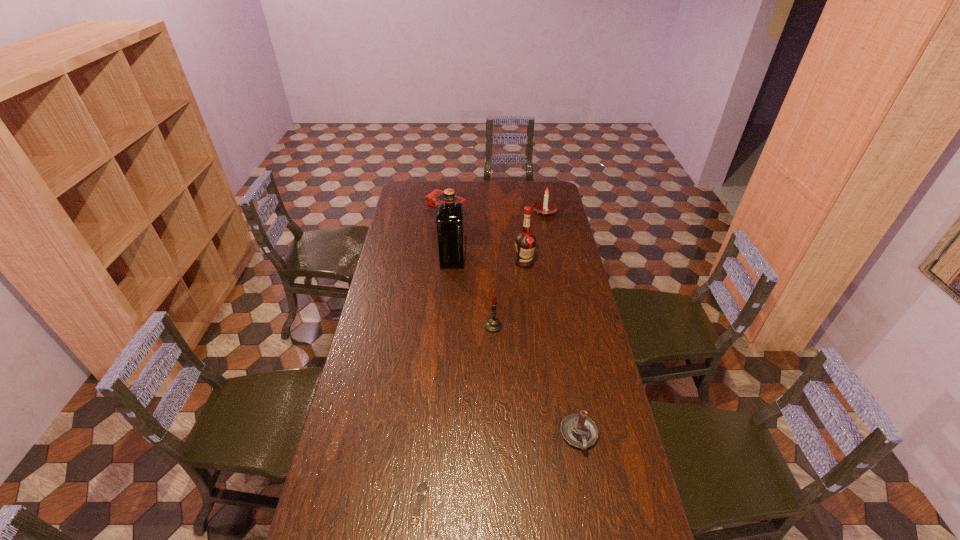
Where is `free space at the left edge`? Image resolution: width=960 pixels, height=540 pixels. free space at the left edge is located at coordinates (339, 525).

In the image, there is a desktop. Where is `free space at the right edge`? The width and height of the screenshot is (960, 540). free space at the right edge is located at coordinates (616, 434).

I want to click on vacant area at the far left corner, so click(x=419, y=188).

Find the location of a particular element. The width and height of the screenshot is (960, 540). free spot between the shortest object and the camera is located at coordinates tap(433, 362).

Image resolution: width=960 pixels, height=540 pixels. I want to click on free space between the taller liquor and the nearest object, so click(436, 381).

Identify the location of free space that is in between the sixth shortest object and the tallest object. (489, 261).

Identify the location of empty location between the fifth object from left to right and the nearest object. The image size is (960, 540). (472, 382).

Identify the location of vacant space that is in between the right liquor and the left liquor. (489, 261).

Find the location of `vacant space that's between the shortest object and the second tallest candle`. vacant space that's between the shortest object and the second tallest candle is located at coordinates (482, 357).

At what (x,y) coordinates should I click in order to perform the action: click on empty space that is in between the second tallest candle and the nearest candle. Please return your answer as a coordinate pair (x, y). This screenshot has height=540, width=960. Looking at the image, I should click on (562, 323).